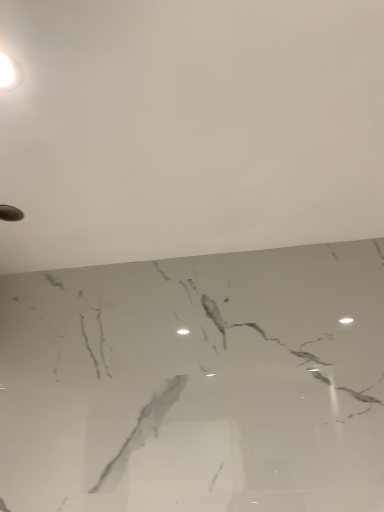
Question: Is white marble floor at lower center further to the viewer compared to white glossy light fixture at upper left?

Choices:
 (A) no
 (B) yes

Answer: (A)

Question: Is white glossy light fixture at upper left at the back of white marble floor at lower center?

Choices:
 (A) no
 (B) yes

Answer: (B)

Question: Could you tell me if white marble floor at lower center is turned towards white glossy light fixture at upper left?

Choices:
 (A) yes
 (B) no

Answer: (B)

Question: From the image's perspective, does white marble floor at lower center appear higher than white glossy light fixture at upper left?

Choices:
 (A) yes
 (B) no

Answer: (B)

Question: Is white marble floor at lower center in front of white glossy light fixture at upper left?

Choices:
 (A) yes
 (B) no

Answer: (A)

Question: Is white marble floor at lower center shorter than white glossy light fixture at upper left?

Choices:
 (A) yes
 (B) no

Answer: (B)

Question: From a real-world perspective, does white glossy light fixture at upper left sit lower than white marble floor at lower center?

Choices:
 (A) no
 (B) yes

Answer: (B)

Question: Considering the relative sizes of white glossy light fixture at upper left and white marble floor at lower center in the image provided, is white glossy light fixture at upper left shorter than white marble floor at lower center?

Choices:
 (A) no
 (B) yes

Answer: (B)

Question: Would you say white glossy light fixture at upper left contains white marble floor at lower center?

Choices:
 (A) yes
 (B) no

Answer: (B)

Question: Considering the relative positions of white glossy light fixture at upper left and white marble floor at lower center in the image provided, is white glossy light fixture at upper left to the left of white marble floor at lower center from the viewer's perspective?

Choices:
 (A) no
 (B) yes

Answer: (B)

Question: Considering the relative sizes of white glossy light fixture at upper left and white marble floor at lower center in the image provided, is white glossy light fixture at upper left bigger than white marble floor at lower center?

Choices:
 (A) no
 (B) yes

Answer: (A)

Question: Can you confirm if white glossy light fixture at upper left is thinner than white marble floor at lower center?

Choices:
 (A) yes
 (B) no

Answer: (A)

Question: Is white glossy light fixture at upper left taller or shorter than white marble floor at lower center?

Choices:
 (A) tall
 (B) short

Answer: (B)